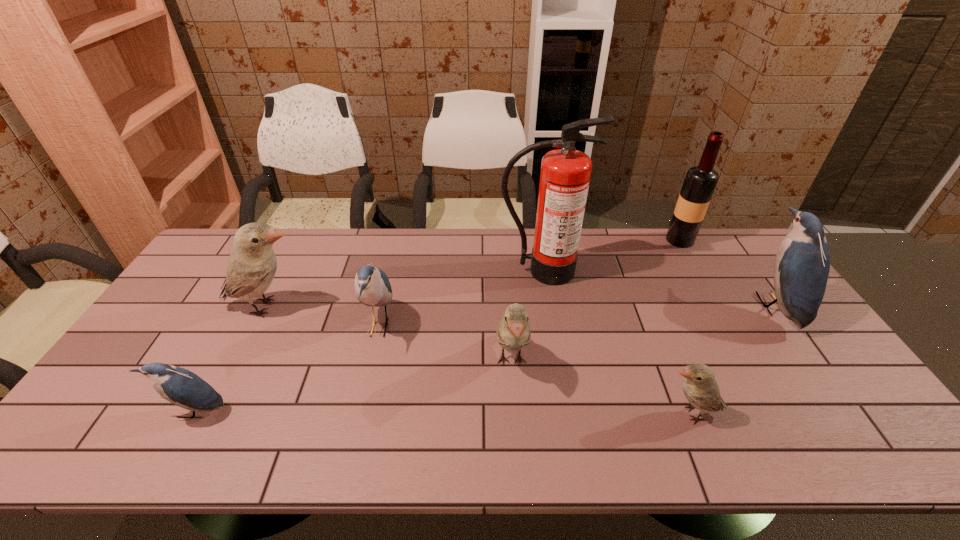
Find the location of a particular element. vacant space located at the tip of the rightmost bird's beak is located at coordinates point(732,305).

Where is `vacant space situated 0.310m at the face of the farthest white bird`? vacant space situated 0.310m at the face of the farthest white bird is located at coordinates (412, 307).

Locate an element on the screen. This screenshot has width=960, height=540. vacant space located 0.240m at the tip of the second blue bird from right to left's beak is located at coordinates pyautogui.click(x=477, y=326).

Where is `free spot located 0.110m at the face of the second farthest white bird`? The width and height of the screenshot is (960, 540). free spot located 0.110m at the face of the second farthest white bird is located at coordinates (516, 435).

Locate an element on the screen. The image size is (960, 540). free region located 0.080m at the tip of the smallest blue bird's beak is located at coordinates (170, 457).

Locate an element on the screen. vacant space located at the face of the second bird from right to left is located at coordinates pos(605,414).

The height and width of the screenshot is (540, 960). Find the location of `free region located 0.200m at the face of the second bird from right to left`. free region located 0.200m at the face of the second bird from right to left is located at coordinates [x=575, y=414].

Where is `vacant space located 0.090m at the face of the second bird from right to left`? This screenshot has height=540, width=960. vacant space located 0.090m at the face of the second bird from right to left is located at coordinates [621, 414].

Where is `fire extinguisher located at the far edge`? This screenshot has height=540, width=960. fire extinguisher located at the far edge is located at coordinates (565, 174).

This screenshot has height=540, width=960. Identify the location of wine bottle positioned at the far edge. (700, 181).